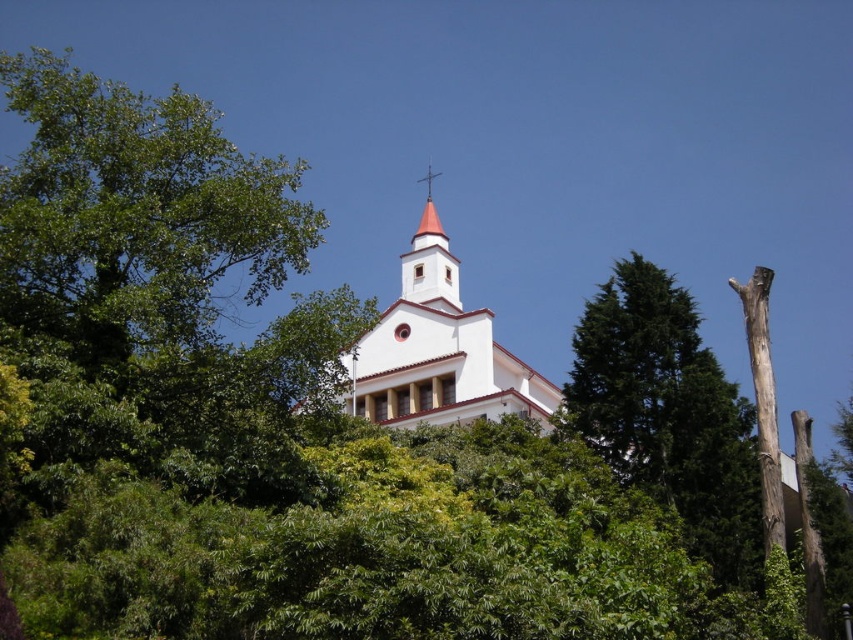
You are standing in front of the white stucco church at center and looking towards the green textured tree at right. Which object appears taller from your perspective?

The white stucco church at center appears taller than the green textured tree at right because the green textured tree at right is not as tall as the white stucco church at center.